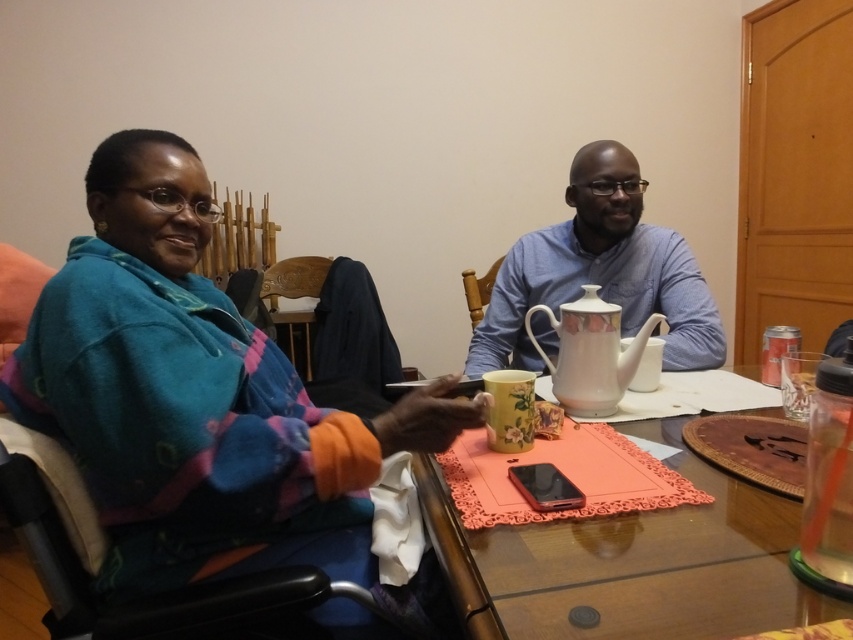
What is located at the coordinates point (x=654, y=566) in the image?

The point (x=654, y=566) indicates a matte plastic phone at center.